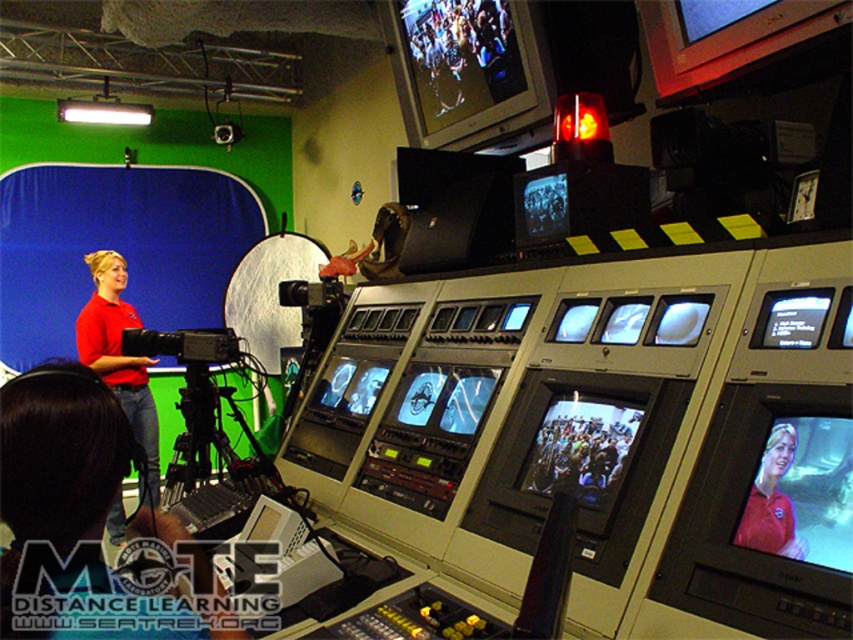
Is red shirt at left to the left of matte red shirt at center from the viewer's perspective?

Indeed, red shirt at left is positioned on the left side of matte red shirt at center.

Which is behind, point (115, 545) or point (753, 492)?

Positioned behind is point (115, 545).

The height and width of the screenshot is (640, 853). Identify the location of red shirt at left. point(119,356).

Is point (262, 464) positioned behind point (785, 445)?

Yes, it is.

Between point (196, 412) and point (788, 435), which one is positioned behind?

The point (196, 412) is behind.

Is point (225, 348) closer to camera compared to point (763, 499)?

No, it is not.

Find the location of `matte black video camera at left`. matte black video camera at left is located at coordinates (206, 404).

Which is more to the right, matte red shirt at left or matte black monitor at center right?

matte black monitor at center right

Is matte red shirt at left smaller than matte black monitor at center right?

No.

Who is more forward, (6, 435) or (821, 317)?

Positioned in front is point (6, 435).

Locate an element on the screen. matte red shirt at left is located at coordinates (57, 470).